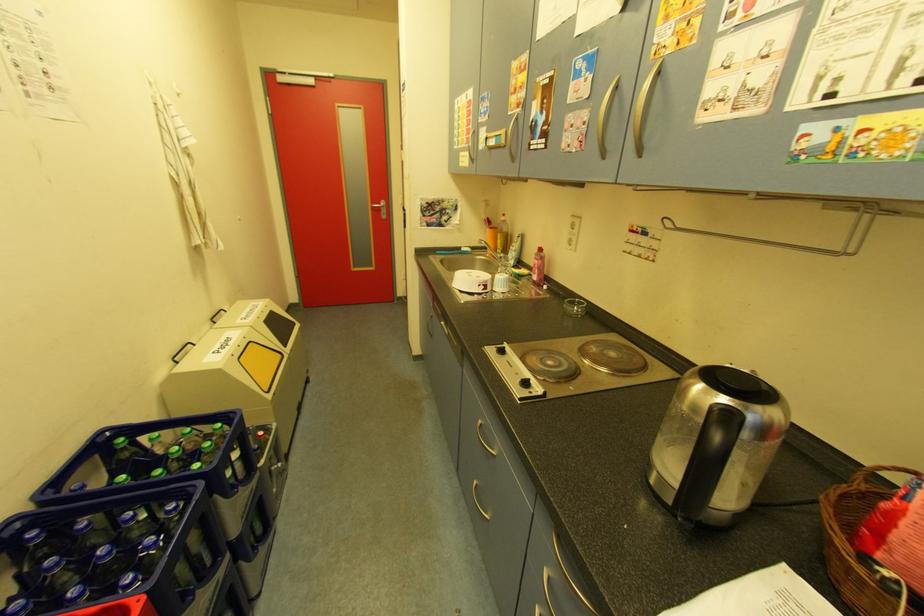
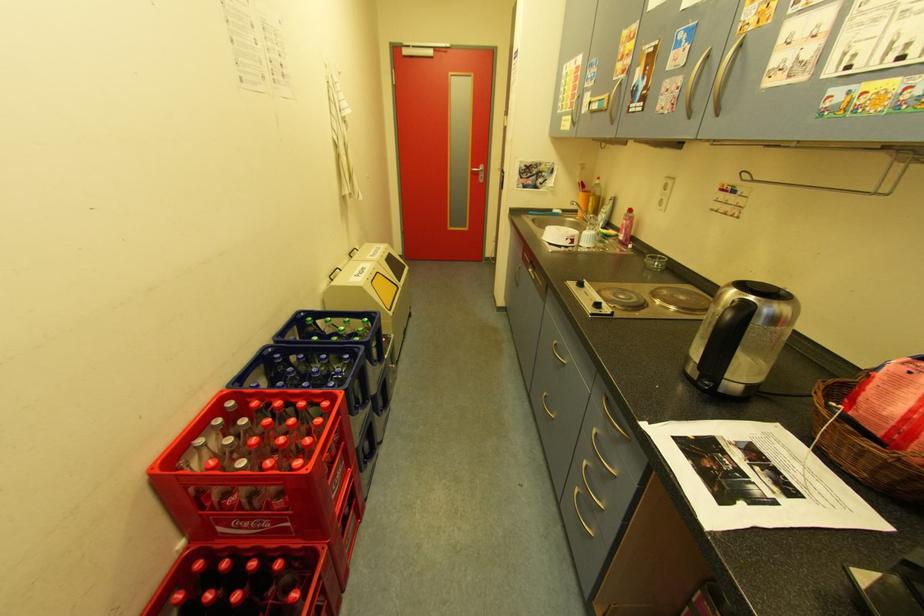
Question: The images are taken continuously from a first-person perspective. In which direction are you moving?

Choices:
 (A) Left
 (B) Right
 (C) Forward
 (D) Backward

Answer: (D)